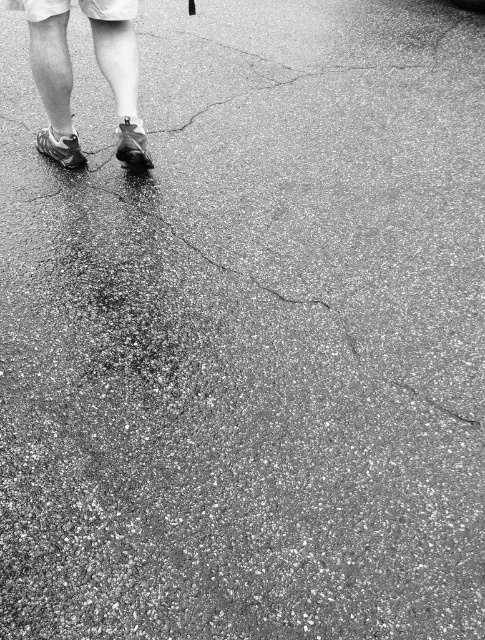
In the scene shown: You are standing at the point closest to the viewer in the image. The two points are marked as point 1 at coordinates point (62, 65) and point 2 at coordinates point (64, 164). Which point should you move towards to stay closer to your current position?

You should move towards point 1 at coordinates point (62, 65) because it is closer to the viewer than point (64, 164).

You are standing on the asphalt pavement and see two shoes, the matte black sneakers at lower left and the shiny black shoe at lower left. Which shoe is positioned more to the left?

The shiny black shoe at lower left is positioned more to the left because the matte black sneakers at lower left is to the right of it.